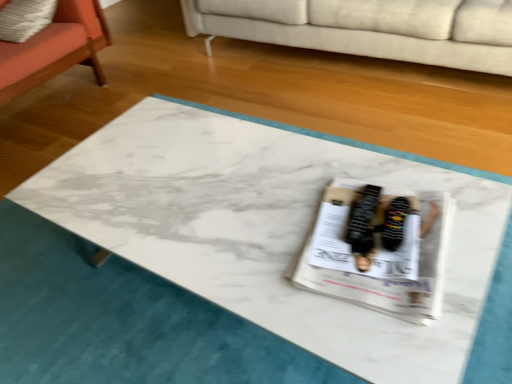
Question: Is the surface of white glossy magazine at center in direct contact with orange fabric chair at left?

Choices:
 (A) no
 (B) yes

Answer: (A)

Question: Can you confirm if white glossy magazine at center is thinner than orange fabric chair at left?

Choices:
 (A) no
 (B) yes

Answer: (B)

Question: Considering the relative sizes of white glossy magazine at center and orange fabric chair at left in the image provided, is white glossy magazine at center shorter than orange fabric chair at left?

Choices:
 (A) no
 (B) yes

Answer: (B)

Question: Can orange fabric chair at left be found inside white glossy magazine at center?

Choices:
 (A) yes
 (B) no

Answer: (B)

Question: Considering the relative positions of white glossy magazine at center and orange fabric chair at left in the image provided, is white glossy magazine at center to the right of orange fabric chair at left from the viewer's perspective?

Choices:
 (A) no
 (B) yes

Answer: (B)

Question: Considering the positions of beige fabric couch at upper center and orange fabric chair at left in the image, is beige fabric couch at upper center bigger or smaller than orange fabric chair at left?

Choices:
 (A) big
 (B) small

Answer: (A)

Question: From a real-world perspective, is beige fabric couch at upper center positioned above or below orange fabric chair at left?

Choices:
 (A) below
 (B) above

Answer: (A)

Question: Is beige fabric couch at upper center to the left or to the right of orange fabric chair at left in the image?

Choices:
 (A) right
 (B) left

Answer: (A)

Question: Is beige fabric couch at upper center inside or outside of orange fabric chair at left?

Choices:
 (A) inside
 (B) outside

Answer: (B)

Question: Relative to beige fabric couch at upper center, is black suede sneakers at center in front or behind?

Choices:
 (A) behind
 (B) front

Answer: (B)

Question: Is black suede sneakers at center inside or outside of beige fabric couch at upper center?

Choices:
 (A) inside
 (B) outside

Answer: (B)

Question: From a real-world perspective, is black suede sneakers at center above or below beige fabric couch at upper center?

Choices:
 (A) below
 (B) above

Answer: (B)

Question: Would you say black suede sneakers at center is to the left or to the right of beige fabric couch at upper center in the picture?

Choices:
 (A) right
 (B) left

Answer: (B)

Question: From their relative heights in the image, would you say beige fabric couch at upper center is taller or shorter than white glossy magazine at center?

Choices:
 (A) tall
 (B) short

Answer: (A)

Question: In terms of width, does beige fabric couch at upper center look wider or thinner when compared to white glossy magazine at center?

Choices:
 (A) thin
 (B) wide

Answer: (B)